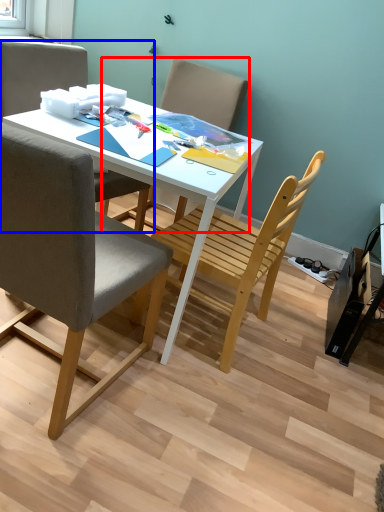
Question: Which of the following is the closest to the observer, chair (highlighted by a red box) or chair (highlighted by a blue box)?

Choices:
 (A) chair
 (B) chair

Answer: (B)